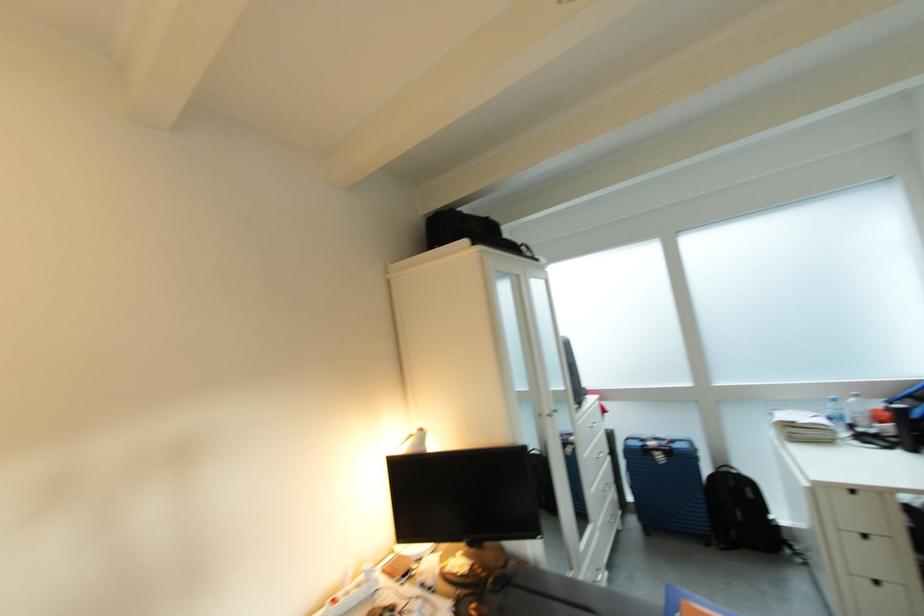
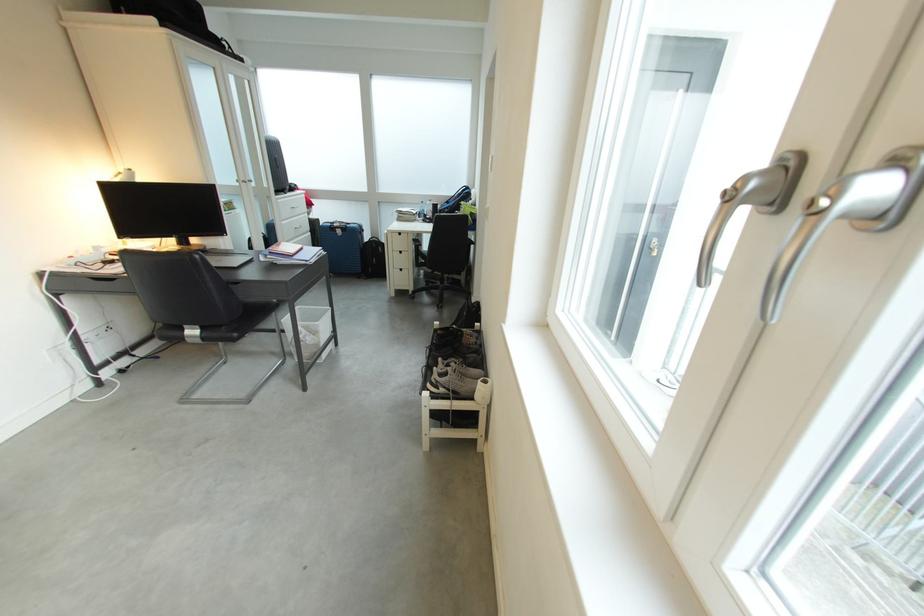
Where in the second image is the point corresponding to pixel 444 447 from the first image?

(152, 183)